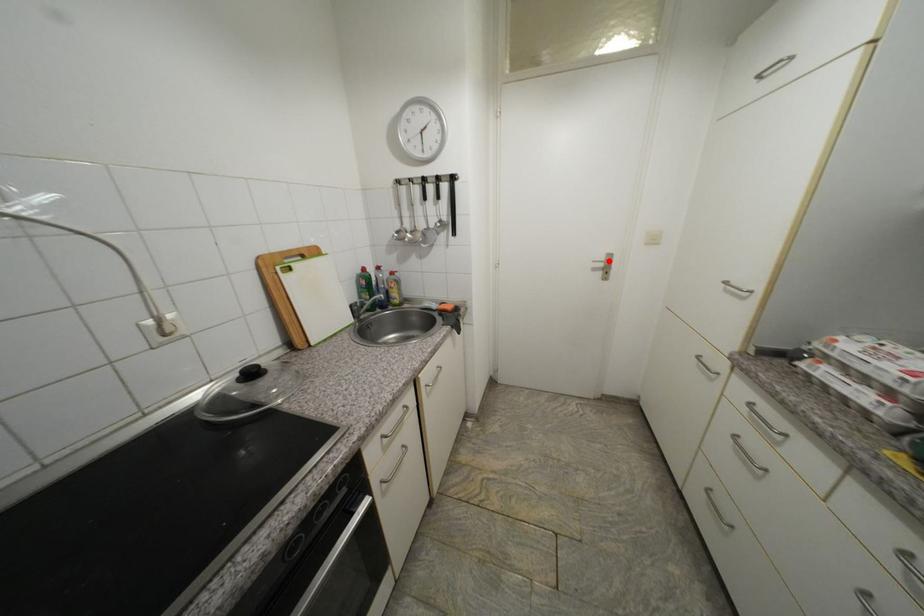
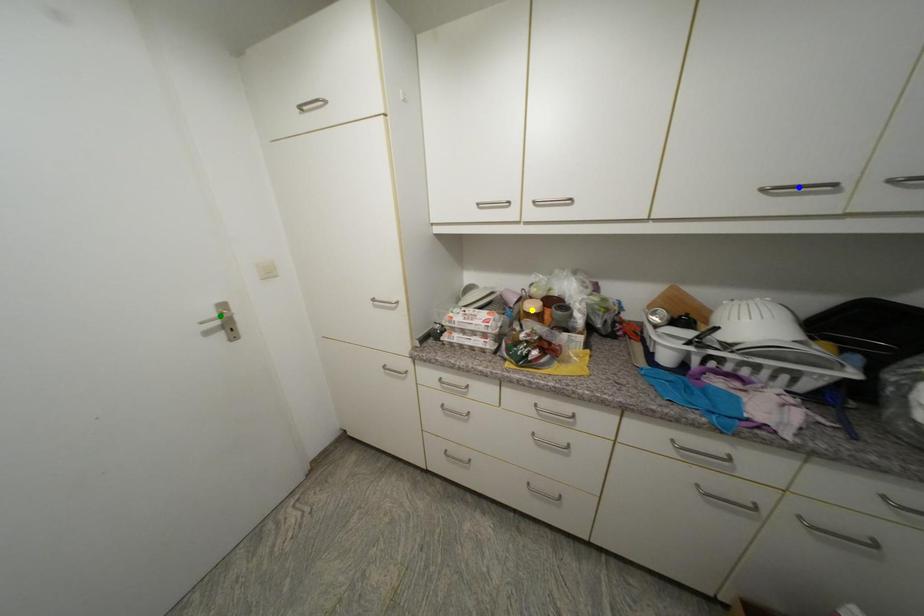
Question: I am providing you with two images of the same scene from different viewpoints. A red point is marked on the first image. You are given multiple points on the second image. Can you choose the point in image 2 that corresponds to the point in image 1?

Choices:
 (A) green point
 (B) yellow point
 (C) blue point

Answer: (A)